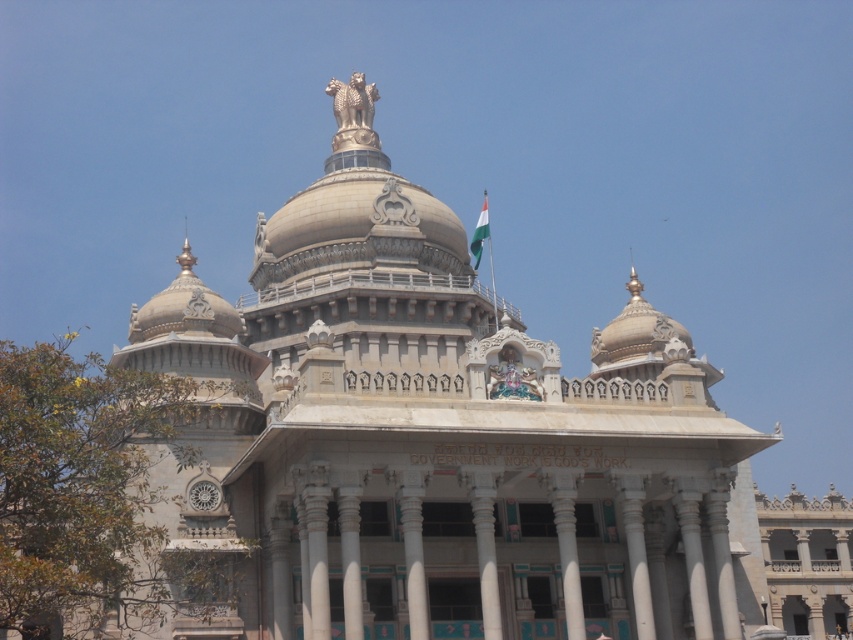
You are a drone operator tasked with capturing aerial footage of the building. The polychrome stone statue at center and the green fabric flag at upper center are both important landmarks. If your drone can only capture objects within a 30 meter radius of its position, where should you position the drone to ensure both landmarks are in frame?

The polychrome stone statue at center and green fabric flag at upper center are 32.73 meters apart. To capture both within a 30 meter radius, position the drone between them so that each is within the 30 meter range. Since 32.73 meters exceeds the drone camera range, the drone must be placed closer to the midpoint between them to ensure both are within the 30 meter radius.

You are standing in front of the grand building and want to take a photo of the polychrome stone statue at center. If your camera has a maximum zoom range of 50 meters, will you be able to capture the statue clearly in your photo?

The polychrome stone statue at center is 61.94 meters away from the camera. Since the camera can only zoom up to 50 meters, it won cannot capture the statue clearly at this distance.

You are an architect designing a scale model of this building. You need to ensure the polychrome stone statue at center and the green fabric flag at upper center are proportionally accurate. Which object should be made smaller in the model?

The polychrome stone statue at center should be made smaller in the model because it has a lesser height compared to the green fabric flag at upper center.